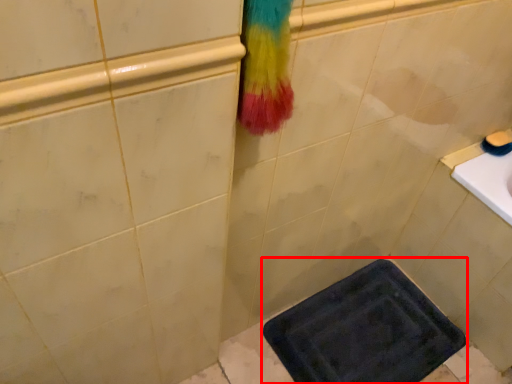
Question: From the image's perspective, where is bath mat (annotated by the red box) located in relation to soap in the image?

Choices:
 (A) above
 (B) below

Answer: (B)